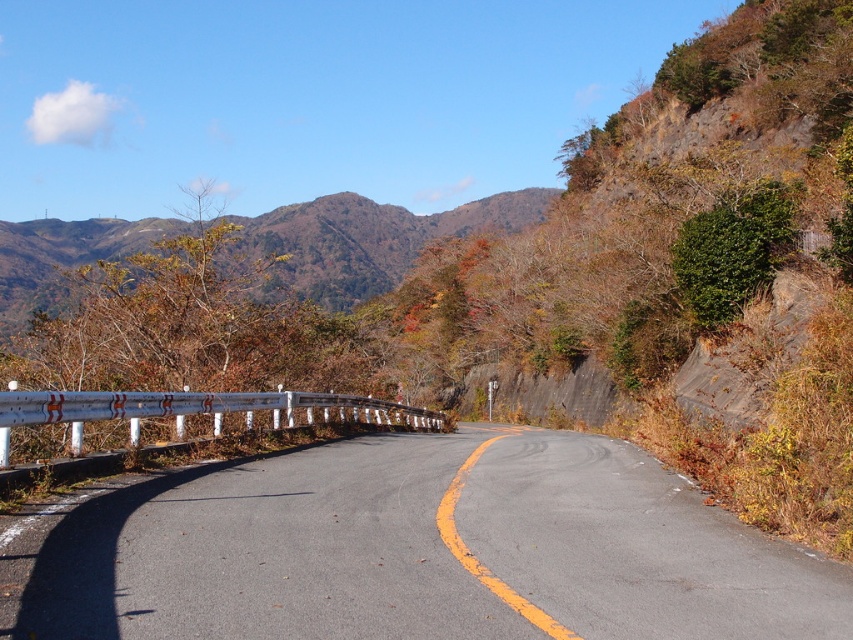
Is asphalt road at center to the right of brown textured mountain at upper center from the viewer's perspective?

Indeed, asphalt road at center is positioned on the right side of brown textured mountain at upper center.

What do you see at coordinates (426, 550) in the screenshot? This screenshot has width=853, height=640. I see `asphalt road at center` at bounding box center [426, 550].

Locate an element on the screen. The height and width of the screenshot is (640, 853). asphalt road at center is located at coordinates (426, 550).